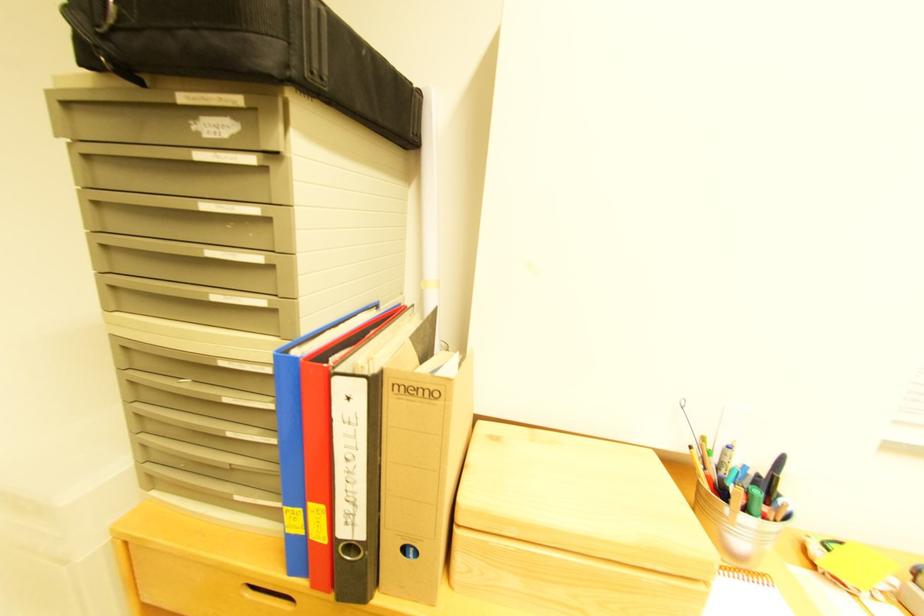
This screenshot has height=616, width=924. I want to click on blue marker, so click(299, 431).